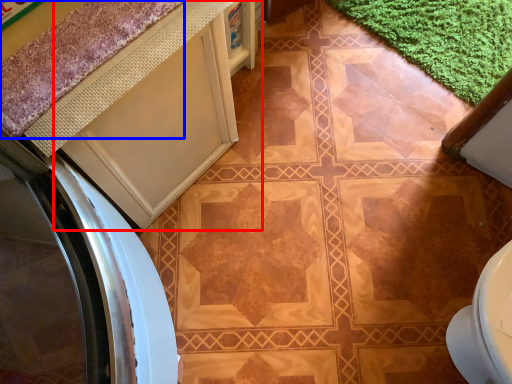
Question: Among these objects, which one is farthest to the camera, cabinetry (highlighted by a red box) or bath mat (highlighted by a blue box)?

Choices:
 (A) cabinetry
 (B) bath mat

Answer: (A)